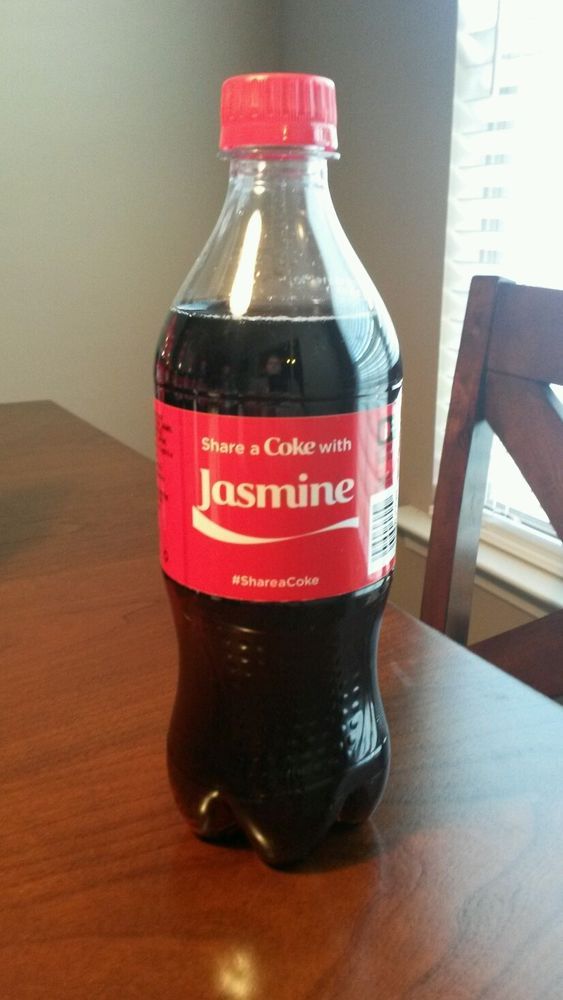
The image size is (563, 1000). I want to click on shutter, so click(x=500, y=113).